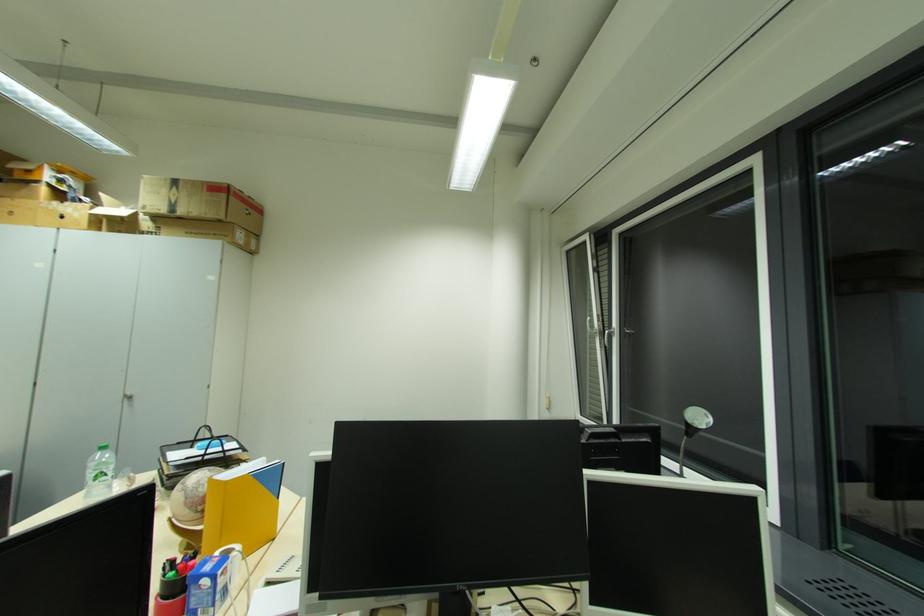
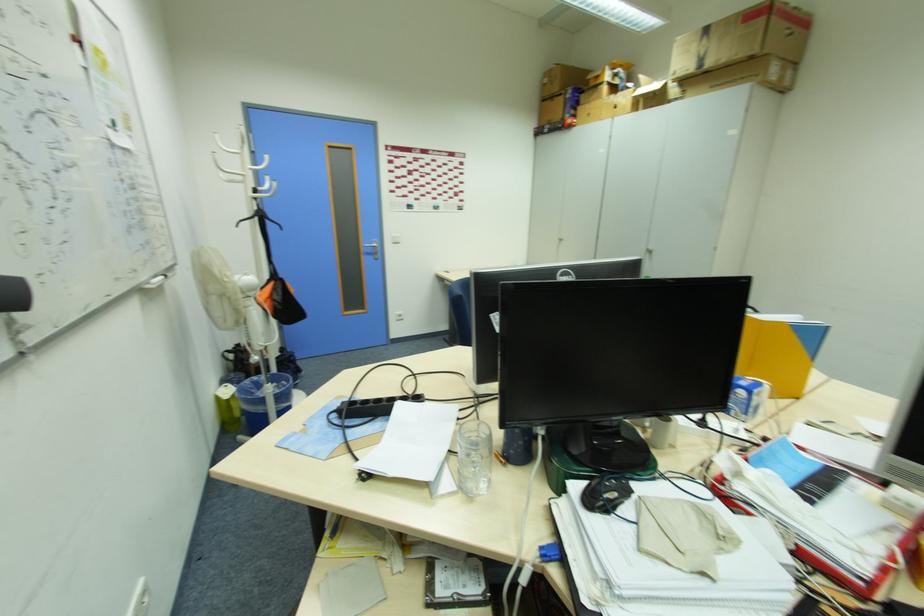
The point at (152,209) is marked in the first image. Where is the corresponding point in the second image?

(685, 71)